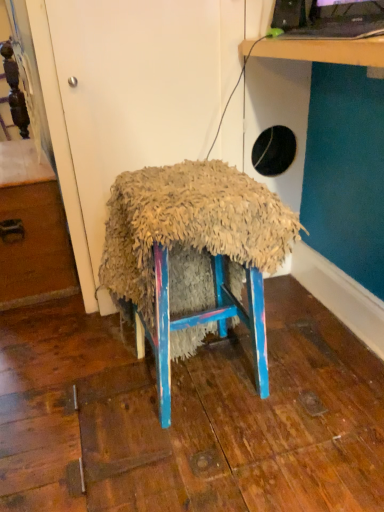
Question: Considering the relative positions of fuzzy fabric stool at center and black glossy desktop computer at upper right in the image provided, is fuzzy fabric stool at center to the right of black glossy desktop computer at upper right from the viewer's perspective?

Choices:
 (A) yes
 (B) no

Answer: (B)

Question: From the image's perspective, is fuzzy fabric stool at center under black glossy desktop computer at upper right?

Choices:
 (A) no
 (B) yes

Answer: (B)

Question: Is fuzzy fabric stool at center closer to the viewer compared to black glossy desktop computer at upper right?

Choices:
 (A) no
 (B) yes

Answer: (A)

Question: Does fuzzy fabric stool at center turn towards black glossy desktop computer at upper right?

Choices:
 (A) no
 (B) yes

Answer: (A)

Question: From a real-world perspective, is fuzzy fabric stool at center physically above black glossy desktop computer at upper right?

Choices:
 (A) yes
 (B) no

Answer: (B)

Question: Is fuzzy fabric stool at center in front of or behind black glossy desktop computer at upper right in the image?

Choices:
 (A) front
 (B) behind

Answer: (B)

Question: In terms of width, does fuzzy fabric stool at center look wider or thinner when compared to black glossy desktop computer at upper right?

Choices:
 (A) thin
 (B) wide

Answer: (B)

Question: From a real-world perspective, is fuzzy fabric stool at center positioned above or below black glossy desktop computer at upper right?

Choices:
 (A) below
 (B) above

Answer: (A)

Question: Is fuzzy fabric stool at center inside or outside of black glossy desktop computer at upper right?

Choices:
 (A) inside
 (B) outside

Answer: (B)

Question: Is wooden table at upper right bigger or smaller than wooden drawer at left?

Choices:
 (A) big
 (B) small

Answer: (B)

Question: From a real-world perspective, relative to wooden drawer at left, is wooden table at upper right vertically above or below?

Choices:
 (A) above
 (B) below

Answer: (A)

Question: From their relative heights in the image, would you say wooden table at upper right is taller or shorter than wooden drawer at left?

Choices:
 (A) short
 (B) tall

Answer: (A)

Question: Which is correct: wooden table at upper right is inside wooden drawer at left, or outside of it?

Choices:
 (A) outside
 (B) inside

Answer: (A)

Question: From the image's perspective, is wooden drawer at left positioned above or below black glossy desktop computer at upper right?

Choices:
 (A) above
 (B) below

Answer: (B)

Question: In terms of width, does wooden drawer at left look wider or thinner when compared to black glossy desktop computer at upper right?

Choices:
 (A) thin
 (B) wide

Answer: (B)